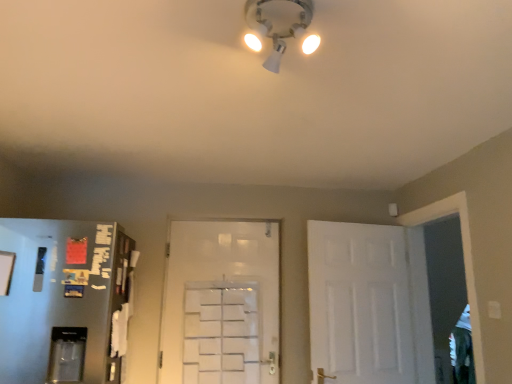
Question: In terms of width, does white matte door at center, marked as the second door in a right-to-left arrangement, look wider or thinner when compared to white matte door at right, which is counted as the 1th door, starting from the right?

Choices:
 (A) wide
 (B) thin

Answer: (B)

Question: From their relative heights in the image, would you say white matte door at center, marked as the second door in a right-to-left arrangement, is taller or shorter than white matte door at right, which is counted as the 1th door, starting from the right?

Choices:
 (A) tall
 (B) short

Answer: (A)

Question: Which is farther from the white matte door at right, which is counted as the 1th door, starting from the right?

Choices:
 (A) white plastic light fixture at upper center
 (B) white matte door at center, the 1th door when ordered from left to right

Answer: (A)

Question: Which object is positioned farthest from the white matte door at right, the 2th door when ordered from left to right?

Choices:
 (A) white matte door at center, marked as the second door in a right-to-left arrangement
 (B) white plastic light fixture at upper center

Answer: (B)